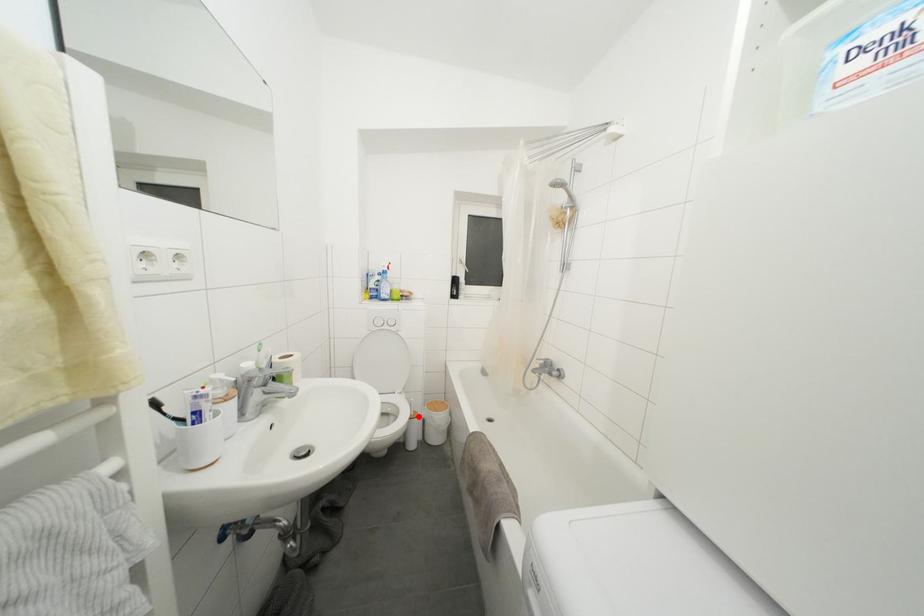
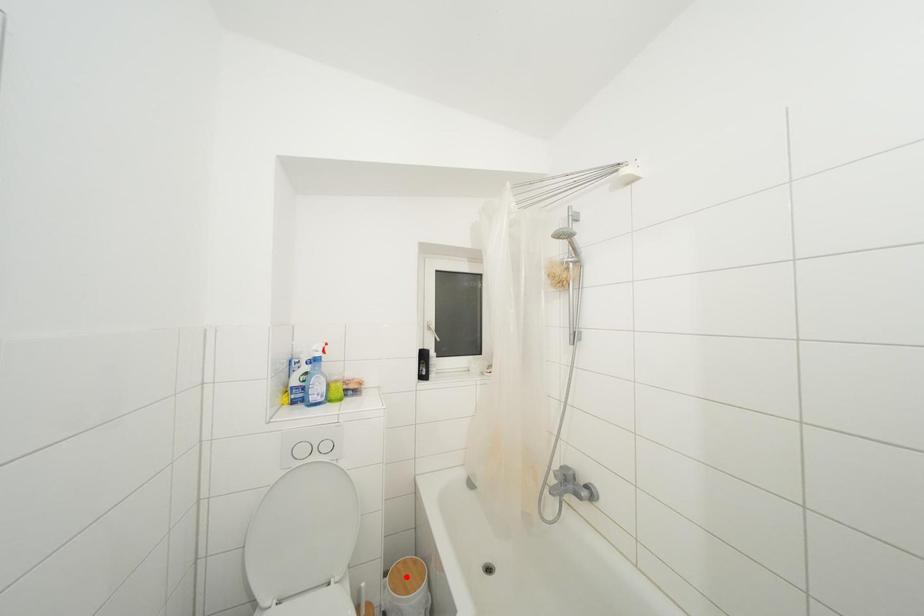
I am providing you with two images of the same scene from different viewpoints. A red point is marked on the first image and another point is marked on the second image. Do the highlighted points in image1 and image2 indicate the same real-world spot?

No